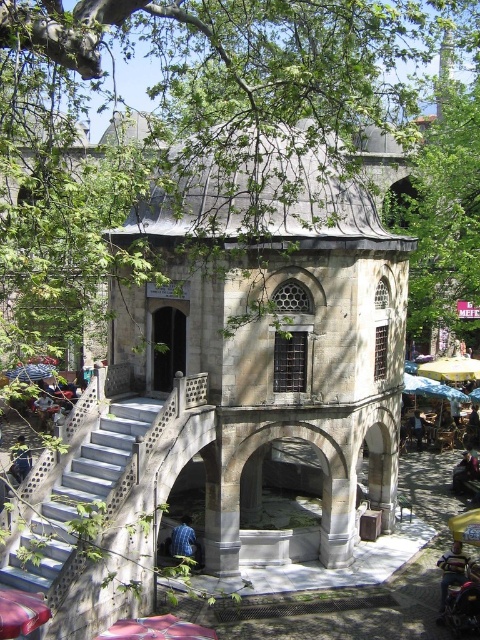
You are standing in the public square and want to take a photo of the metallic pink car at lower center without the green leafy tree at upper left blocking the view. Where should you position yourself to ensure the tree isn t in the frame?

Move to a position where the green leafy tree at upper left is behind the metallic pink car at lower center. Since the green leafy tree at upper left is in front of the metallic pink car at lower center, moving to a spot where the car is between you and the tree would block the tree from view.

You are standing in the courtyard and want to take a photo of the green leafy tree at upper left and the white concrete stairs at lower left. Which object should you focus on first if you want both to be in clear focus?

The green leafy tree at upper left is closer to the viewer than the white concrete stairs at lower left, so you should focus on the green leafy tree at upper left first to ensure both are in focus.

You are standing at the base of the white concrete stairs at lower left and want to reach the green leafy tree at upper left. Which direction should you move to get closer to the tree?

The green leafy tree at upper left is above the white concrete stairs at lower left, so you should move upward to get closer to the tree.